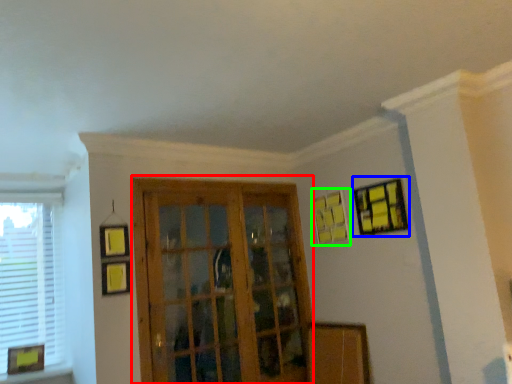
Question: Based on their relative distances, which object is farther from screen door (highlighted by a red box)? Choose from picture frame (highlighted by a blue box) and picture frame (highlighted by a green box).

Choices:
 (A) picture frame
 (B) picture frame

Answer: (A)